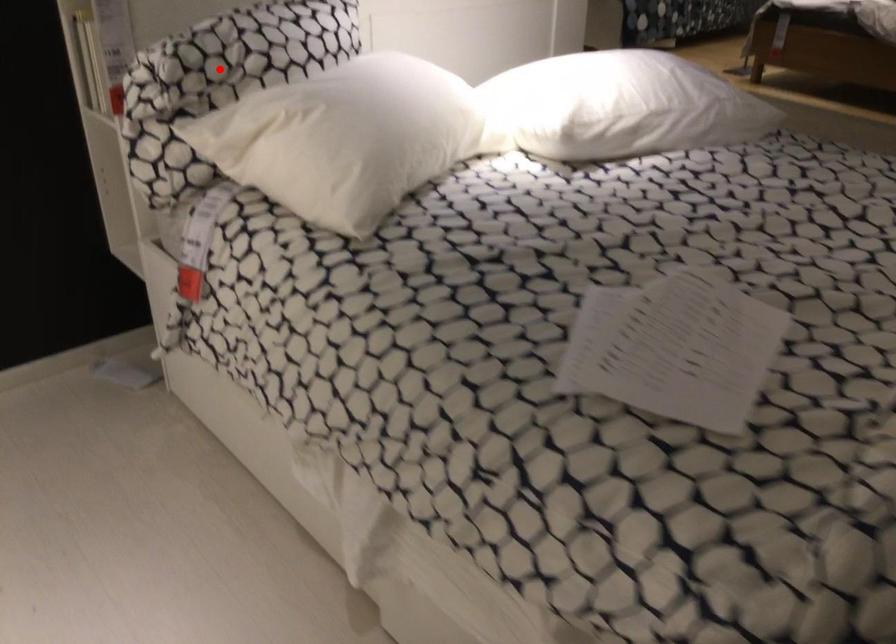
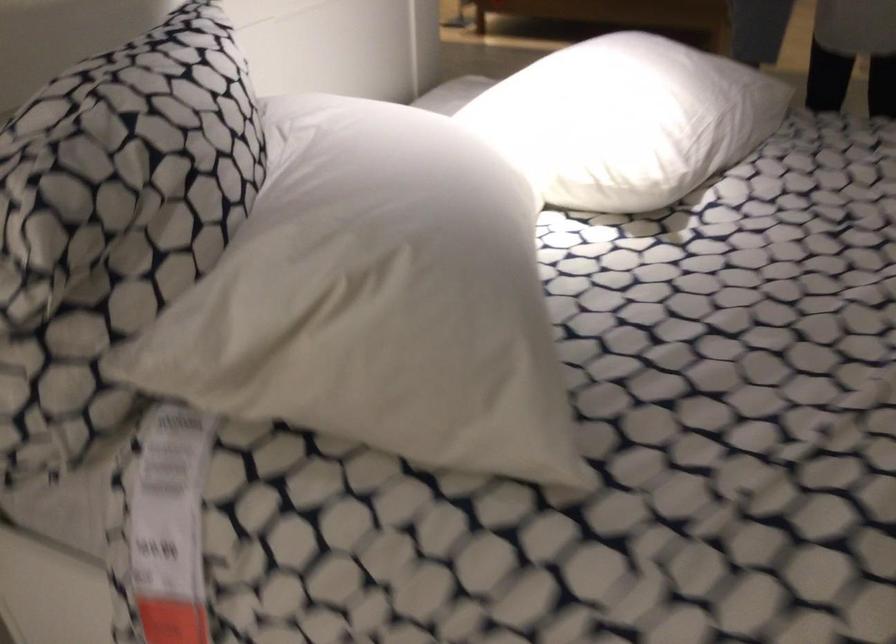
Question: I am providing you with two images of the same scene from different viewpoints. In image1, a red point is highlighted. Considering the same 3D point in image2, which of the following is correct?

Choices:
 (A) It is closer
 (B) It is farther

Answer: (A)